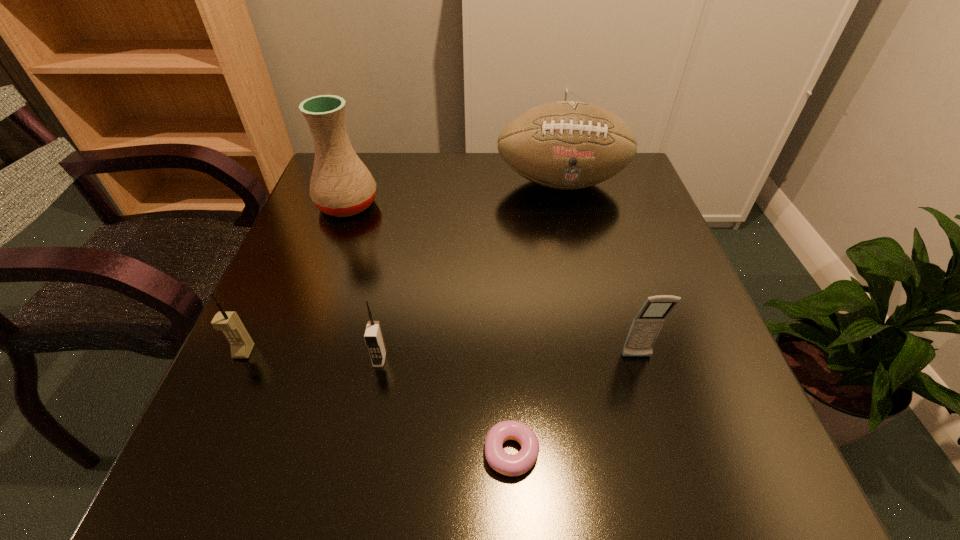
Locate which cellular telephone ranks in proximity to the pottery. Please provide its 2D coordinates. Your answer should be formatted as a tuple, i.e. [(x, y)], where the tuple contains the x and y coordinates of a point satisfying the conditions above.

[(241, 344)]

Identify the location of free location that satisfies the following two spatial constraints: 1. on the front-facing side of the doughnut; 2. on the right side of the third object from left to right. (362, 452).

Where is `blank area in the image that satisfies the following two spatial constraints: 1. on the front-facing side of the shortest object; 2. on the right side of the third object from left to right`? blank area in the image that satisfies the following two spatial constraints: 1. on the front-facing side of the shortest object; 2. on the right side of the third object from left to right is located at coordinates (362, 452).

This screenshot has height=540, width=960. What are the coordinates of `vacant area in the image that satisfies the following two spatial constraints: 1. on the front-facing side of the second cellular telephone from left to right; 2. on the left side of the shortest object` in the screenshot? It's located at (362, 452).